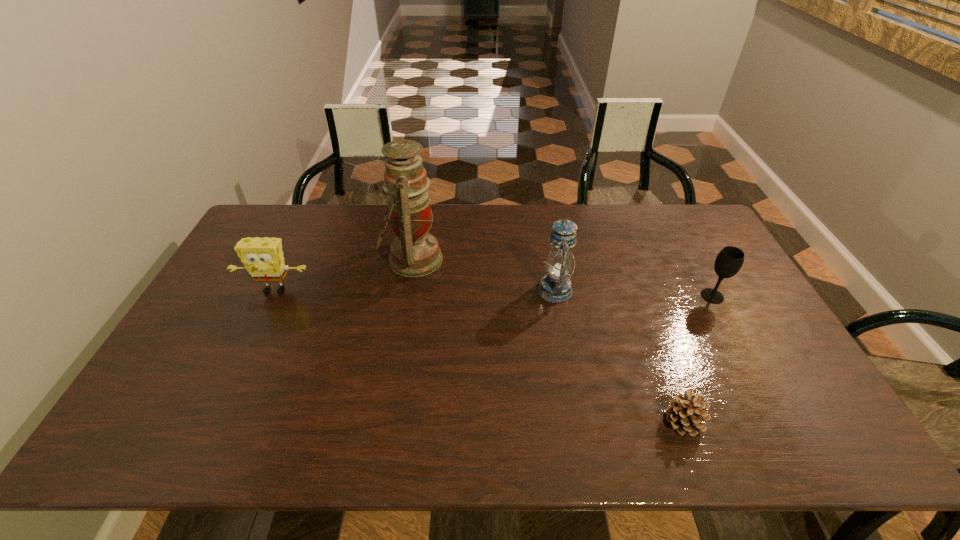
The height and width of the screenshot is (540, 960). I want to click on free space located 0.320m on the front-facing side of the fourth shortest object, so click(433, 290).

The image size is (960, 540). Identify the location of free space located 0.280m on the front-facing side of the fourth shortest object. (446, 290).

This screenshot has height=540, width=960. Identify the location of vacant position located 0.360m on the face of the leftmost object. (218, 407).

The image size is (960, 540). Find the location of `vacant space located on the left of the rightmost object`. vacant space located on the left of the rightmost object is located at coordinates (612, 296).

Locate an element on the screen. blank space located 0.050m on the right of the pinecone is located at coordinates (726, 422).

In order to click on object that is at the far edge in this screenshot , I will do `click(414, 252)`.

The width and height of the screenshot is (960, 540). What are the coordinates of `object at the near edge` in the screenshot? It's located at (686, 414).

This screenshot has height=540, width=960. In order to click on object located at the left edge in this screenshot , I will do `click(263, 258)`.

Locate an element on the screen. The height and width of the screenshot is (540, 960). object present at the right edge is located at coordinates (729, 261).

In the image, there is a desktop. Identify the location of vacant space at the far edge. (611, 230).